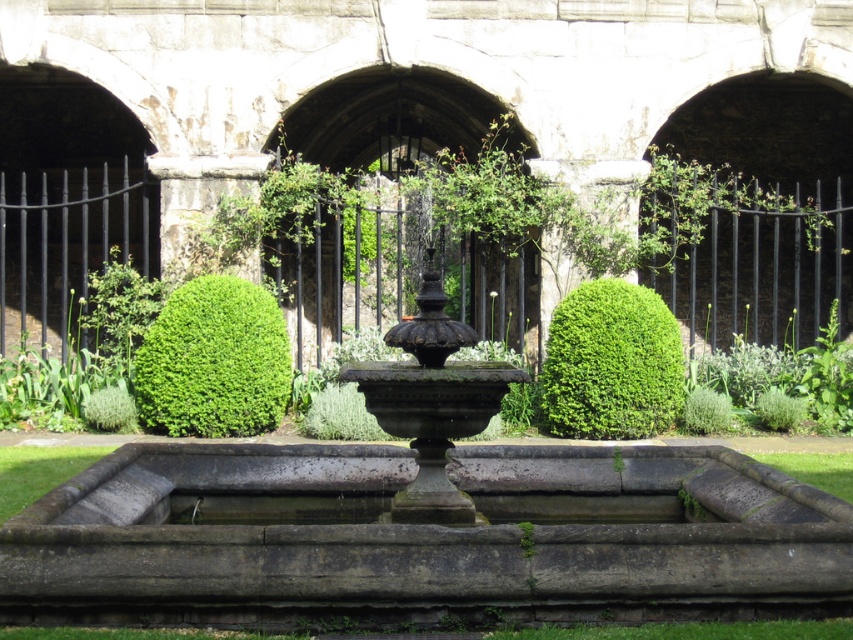
Can you confirm if green leafy bush at left is positioned to the right of green leafy bush at center?

No, green leafy bush at left is not to the right of green leafy bush at center.

Between green leafy bush at left and green leafy bush at center, which one is positioned higher?

green leafy bush at left is higher up.

Who is more distant from viewer, [157,340] or [657,384]?

The point [157,340] is behind.

Where is `green leafy bush at left`? green leafy bush at left is located at coordinates (213, 362).